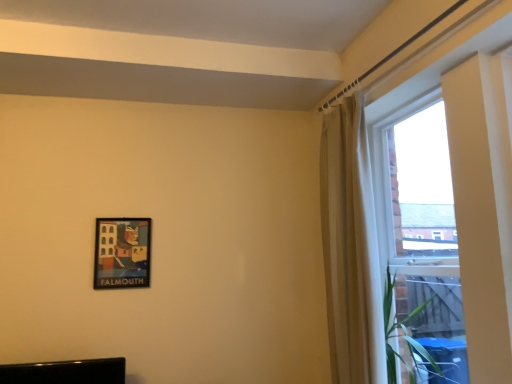
Question: In terms of height, does matte black picture frame at lower left look taller or shorter compared to transparent glass window at right?

Choices:
 (A) short
 (B) tall

Answer: (A)

Question: Would you say matte black picture frame at lower left is to the left or to the right of transparent glass window at right in the picture?

Choices:
 (A) left
 (B) right

Answer: (A)

Question: Estimate the real-world distances between objects in this image. Which object is closer to the beige fabric curtain at upper right?

Choices:
 (A) transparent glass window at right
 (B) matte black picture frame at lower left

Answer: (A)

Question: Based on their relative distances, which object is farther from the beige fabric curtain at upper right?

Choices:
 (A) transparent glass window at right
 (B) matte black picture frame at lower left

Answer: (B)